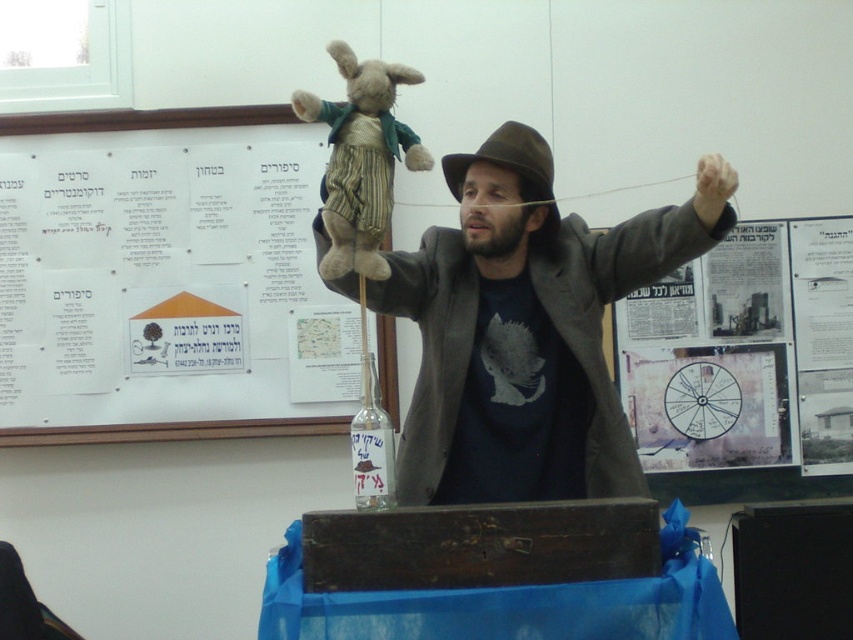
Question: Among these points, which one is farthest from the camera?

Choices:
 (A) [x=508, y=120]
 (B) [x=378, y=444]
 (C) [x=358, y=170]

Answer: (A)

Question: Which of the following is the farthest from the observer?

Choices:
 (A) (537, 243)
 (B) (532, 131)
 (C) (387, 480)

Answer: (A)

Question: Is white paper at upper left above matte paper poster at center?

Choices:
 (A) no
 (B) yes

Answer: (B)

Question: In this image, where is white paper at upper left located relative to matte paper poster at center?

Choices:
 (A) right
 (B) left

Answer: (B)

Question: Which is farther from the white paper at upper left?

Choices:
 (A) brown felt fedora at center
 (B) matte paper poster at center
 (C) transparent glass bottle at center
 (D) fuzzy brown teddy bear at upper center

Answer: (C)

Question: Is fuzzy brown teddy bear at upper center positioned in front of brown felt fedora at center?

Choices:
 (A) yes
 (B) no

Answer: (A)